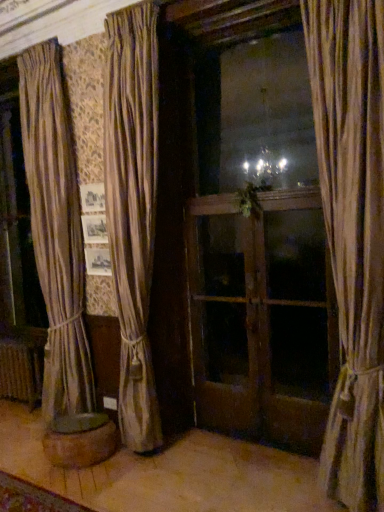
Question: Considering the relative positions of green leafy plant at center and beige fabric curtain at right, which is the 2th curtain from back to front, in the image provided, is green leafy plant at center to the left of beige fabric curtain at right, which is the 2th curtain from back to front, from the viewer's perspective?

Choices:
 (A) no
 (B) yes

Answer: (B)

Question: Would you consider green leafy plant at center to be distant from beige fabric curtain at right, which is the 2th curtain from back to front?

Choices:
 (A) no
 (B) yes

Answer: (B)

Question: Is green leafy plant at center touching beige fabric curtain at right, which is the 2th curtain from back to front?

Choices:
 (A) yes
 (B) no

Answer: (B)

Question: Is green leafy plant at center positioned with its back to beige fabric curtain at right, the second curtain positioned from the left?

Choices:
 (A) yes
 (B) no

Answer: (B)

Question: From the image's perspective, is green leafy plant at center over beige fabric curtain at right, marked as the 1th curtain in a front-to-back arrangement?

Choices:
 (A) no
 (B) yes

Answer: (B)

Question: Is green leafy plant at center at the right side of beige fabric curtain at right, the second curtain positioned from the left?

Choices:
 (A) no
 (B) yes

Answer: (A)

Question: Is wooden screen door at center, placed as the first screen door when sorted from left to right, turned away from beige fabric curtain at right, the second curtain positioned from the left?

Choices:
 (A) no
 (B) yes

Answer: (A)

Question: Does wooden screen door at center, placed as the first screen door when sorted from left to right, lie in front of beige fabric curtain at right, which is the 2th curtain from back to front?

Choices:
 (A) no
 (B) yes

Answer: (A)

Question: Is wooden screen door at center, placed as the first screen door when sorted from left to right, behind beige fabric curtain at right, the first curtain when ordered from right to left?

Choices:
 (A) yes
 (B) no

Answer: (A)

Question: Can you confirm if wooden screen door at center, placed as the first screen door when sorted from left to right, is positioned to the right of beige fabric curtain at right, the second curtain positioned from the left?

Choices:
 (A) yes
 (B) no

Answer: (B)

Question: Is wooden screen door at center, placed as the first screen door when sorted from left to right, oriented towards beige fabric curtain at right, the first curtain when ordered from right to left?

Choices:
 (A) yes
 (B) no

Answer: (B)

Question: Would you say wooden screen door at center, placed as the first screen door when sorted from left to right, contains beige fabric curtain at right, the first curtain when ordered from right to left?

Choices:
 (A) no
 (B) yes

Answer: (A)

Question: From the image's perspective, is silky beige curtain at center, which appears as the 2th curtain when viewed from the right, beneath beige fabric curtain at right, which is the 2th curtain from back to front?

Choices:
 (A) no
 (B) yes

Answer: (A)